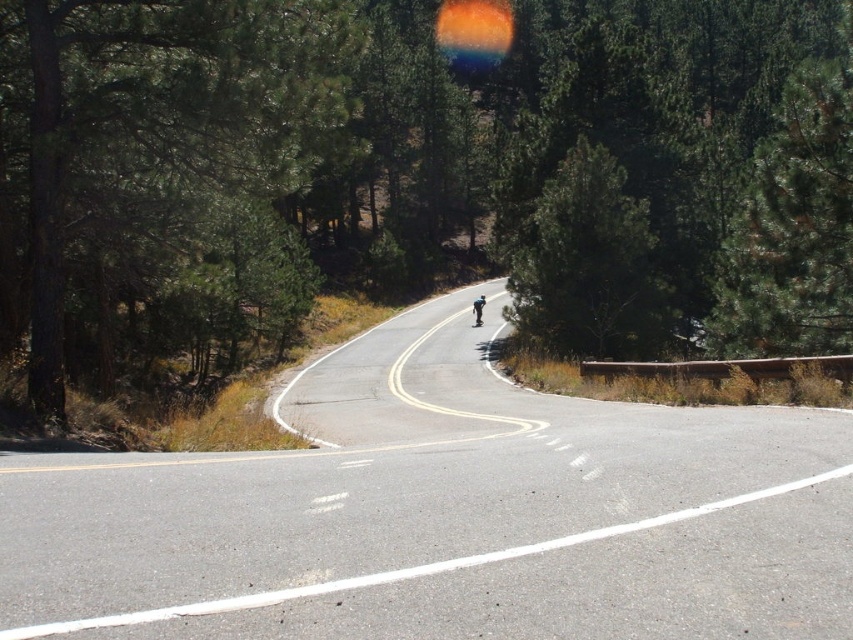
Is asphalt road at left shorter than blue glossy skateboard at center?

Yes, asphalt road at left is shorter than blue glossy skateboard at center.

The height and width of the screenshot is (640, 853). Identify the location of asphalt road at left. (445, 513).

Is point (386, 372) farther from viewer compared to point (474, 321)?

No, it is in front of (474, 321).

The image size is (853, 640). I want to click on asphalt road at left, so click(x=445, y=513).

Is asphalt road at left further to the viewer compared to green matte tree at left?

That is False.

Between asphalt road at left and green matte tree at left, which one has more height?

With more height is green matte tree at left.

Locate an element on the screen. The height and width of the screenshot is (640, 853). asphalt road at left is located at coordinates (445, 513).

Which is more to the right, green leafy tree at center or green matte tree at left?

Positioned to the right is green leafy tree at center.

Is green leafy tree at center smaller than green matte tree at left?

Actually, green leafy tree at center might be larger than green matte tree at left.

Measure the distance between point [575,80] and camera.

134.58 feet

Identify the location of green leafy tree at center. pos(390,168).